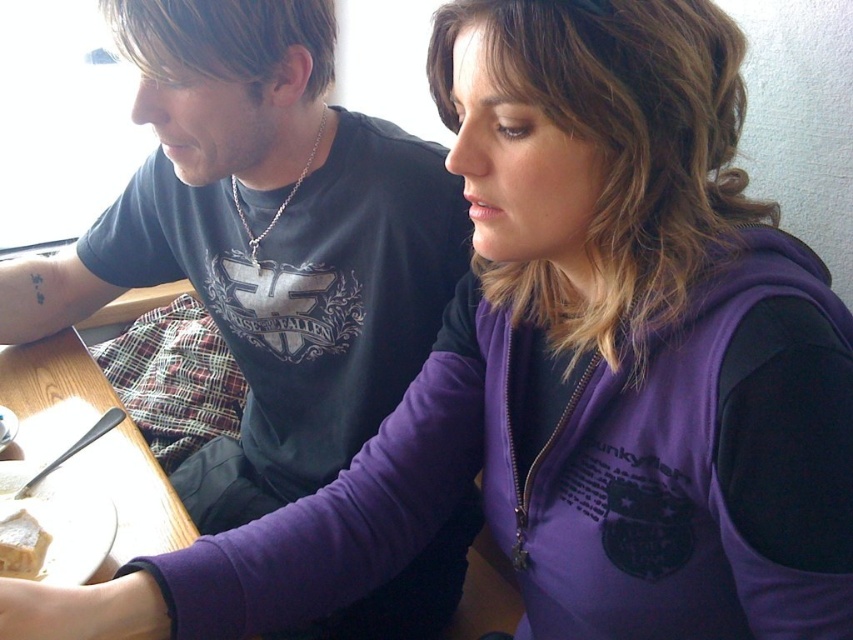
Does wooden table at lower left have a lesser height compared to white crumbly cake at lower left?

No, wooden table at lower left is not shorter than white crumbly cake at lower left.

Is point (76, 387) positioned in front of point (28, 522)?

No, (76, 387) is behind (28, 522).

Measure the distance between point [32,456] and camera.

Point [32,456] and camera are 38.03 inches apart.

I want to click on wooden table at lower left, so click(x=51, y=392).

Looking at this image, who is positioned more to the right, matte black shirt at upper left or white crumbly cake at lower left?

matte black shirt at upper left

Does point (247, 348) come in front of point (3, 548)?

No.

Does point (181, 228) lie behind point (36, 564)?

Yes, point (181, 228) is farther from viewer.

At what (x,y) coordinates should I click in order to perform the action: click on matte black shirt at upper left. Please return your answer as a coordinate pair (x, y). Looking at the image, I should click on (265, 241).

Based on the photo, who is positioned more to the left, matte black shirt at upper left or wooden table at lower left?

wooden table at lower left is more to the left.

Where is `matte black shirt at upper left`? The height and width of the screenshot is (640, 853). matte black shirt at upper left is located at coordinates (265, 241).